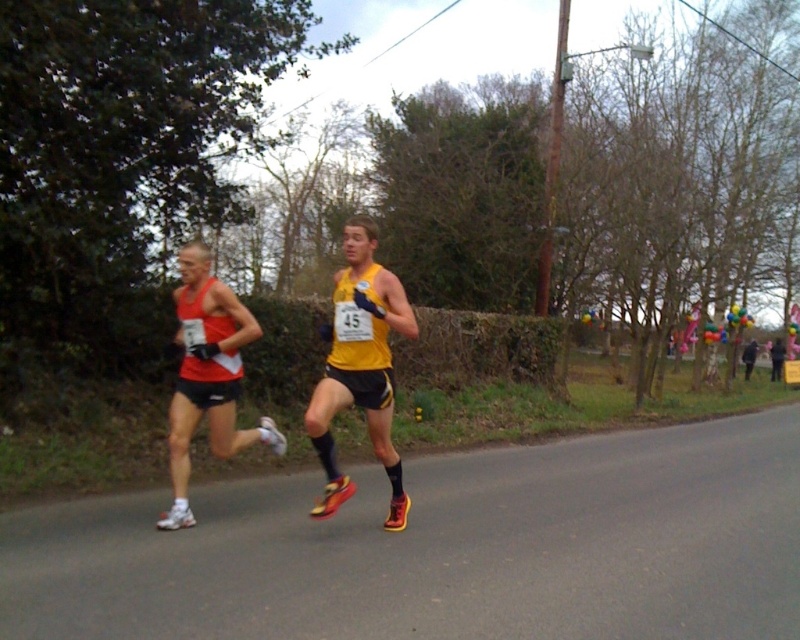
You are a photographer trying to capture a photo of both the matte red tank top at left and the black matte jacket at right in the image. Based on their sizes in the image, which object would appear larger in your photo?

The matte red tank top at left appears larger in the photo because it has a greater height compared to the black matte jacket at right.

You are a photographer positioned at the origin point of the image. You want to capture a closeup shot of the yellow matte running shoe at center. Given that your camera focuses best within a radius of 0.5 units from your position, can you successfully focus on the shoe?

The yellow matte running shoe at center is located at point (360,368), which is within the 0.5 units radius from the origin. Therefore, the camera can successfully focus on the shoe.

Looking at this image, you are a photographer standing at the starting line of the race. You want to capture a photo of the yellow matte running shoe at center. Based on its 2D coordinates, where should you aim your camera relative to the image frame?

The yellow matte running shoe at center is located at the 2D coordinates point (360, 368), which is slightly to the right and above the center of the image frame. Aim your camera slightly right and up from the center to capture it.